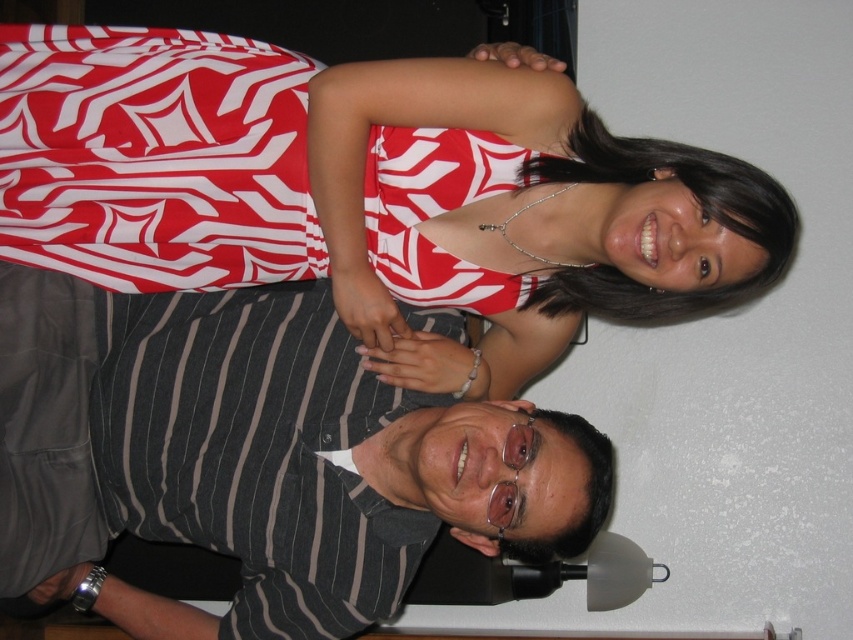
Question: Which point is farther to the camera?

Choices:
 (A) white printed dress at upper center
 (B) striped cotton shirt at lower center

Answer: (B)

Question: Is white printed dress at upper center to the left of striped cotton shirt at lower center from the viewer's perspective?

Choices:
 (A) yes
 (B) no

Answer: (B)

Question: Where is white printed dress at upper center located in relation to striped cotton shirt at lower center in the image?

Choices:
 (A) above
 (B) below

Answer: (A)

Question: Which of the following is the closest to the observer?

Choices:
 (A) (131, 452)
 (B) (158, 260)

Answer: (A)

Question: Considering the relative positions of white printed dress at upper center and striped cotton shirt at lower center in the image provided, where is white printed dress at upper center located with respect to striped cotton shirt at lower center?

Choices:
 (A) above
 (B) below

Answer: (A)